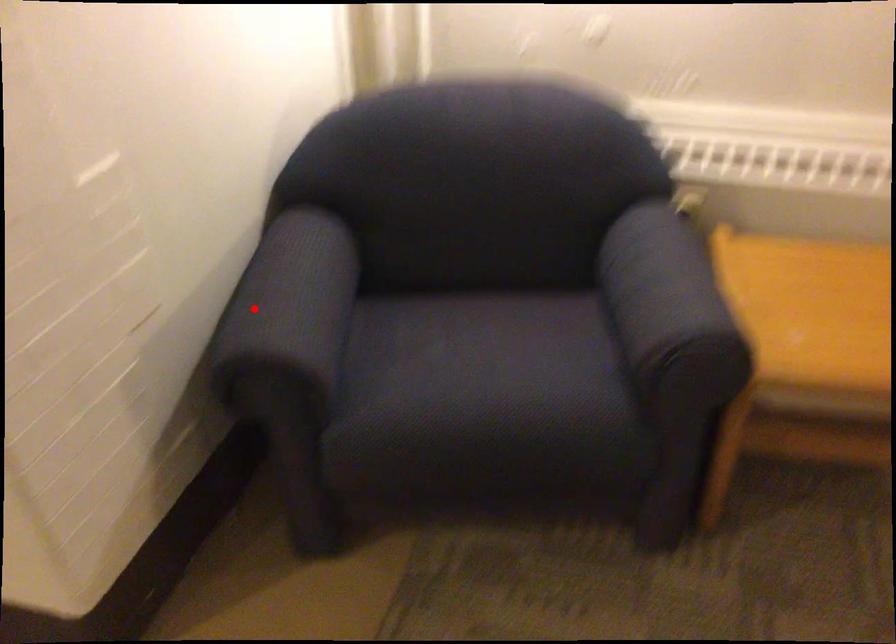
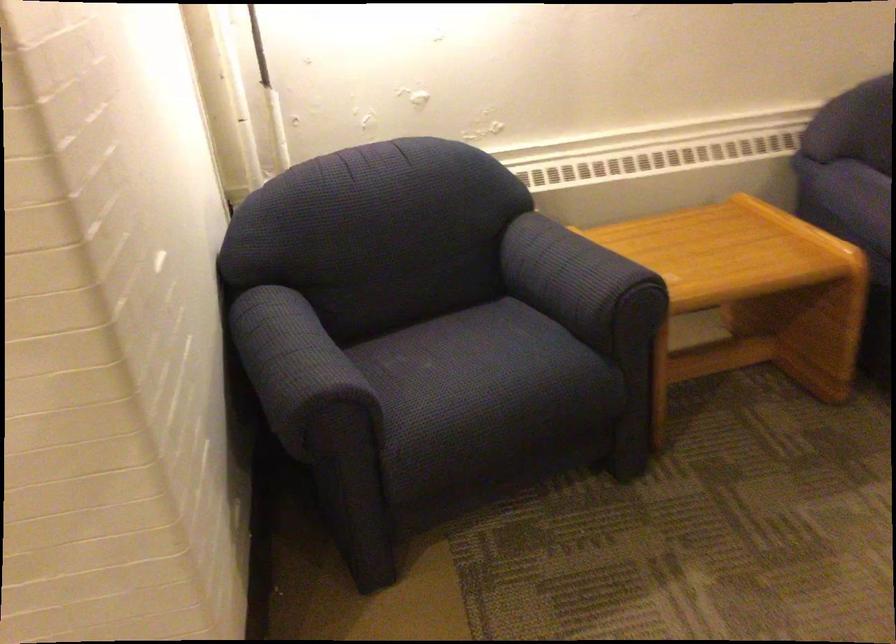
Find the pixel in the second image that matches the highlighted location in the first image.

(294, 363)